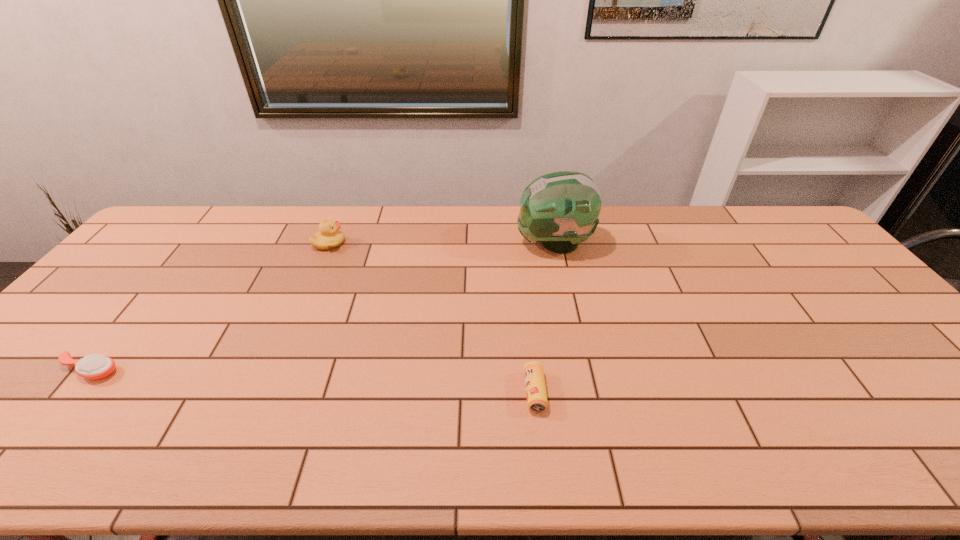
At what (x,y) coordinates should I click in order to perform the action: click on object that is the third closest to the duckling. Please return your answer as a coordinate pair (x, y). Looking at the image, I should click on (536, 395).

Where is `blank area in the image that satisfies the following two spatial constraints: 1. on the front-facing side of the beer can; 2. on the right side of the third object from right to left`? The image size is (960, 540). blank area in the image that satisfies the following two spatial constraints: 1. on the front-facing side of the beer can; 2. on the right side of the third object from right to left is located at coordinates click(x=265, y=392).

Locate an element on the screen. Image resolution: width=960 pixels, height=540 pixels. vacant space that satisfies the following two spatial constraints: 1. on the front-facing side of the beer can; 2. on the right side of the third object from right to left is located at coordinates (265, 392).

Find the location of a particular element. The image size is (960, 540). vacant space that satisfies the following two spatial constraints: 1. on the back side of the beer can; 2. on the front-facing side of the second object from left to right is located at coordinates (518, 243).

Find the location of `vacant space that satisfies the following two spatial constraints: 1. on the front side of the beer can; 2. on the right side of the leftmost object`. vacant space that satisfies the following two spatial constraints: 1. on the front side of the beer can; 2. on the right side of the leftmost object is located at coordinates (72, 392).